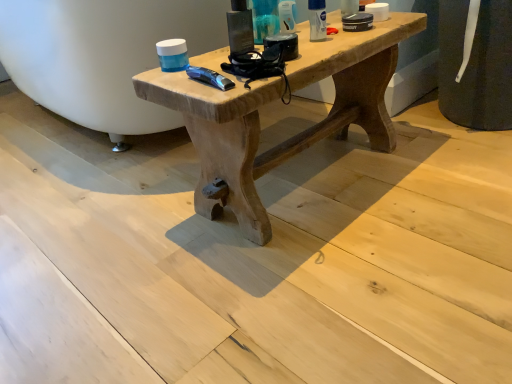
Question: Is point (320, 16) closer or farther from the camera than point (266, 4)?

Choices:
 (A) closer
 (B) farther

Answer: (B)

Question: In terms of size, does white matte deodorant at upper right, the first toiletry from the right, appear bigger or smaller than matte plastic container at upper center, placed as the 3th toiletry when sorted from right to left?

Choices:
 (A) big
 (B) small

Answer: (B)

Question: Considering the real-world distances, which object is farthest from the natural wood table at center?

Choices:
 (A) white matte deodorant at upper right, positioned as the third toiletry in left-to-right order
 (B) translucent plastic tube at upper center, the second toiletry viewed from the left
 (C) matte plastic container at upper center, the 1th toiletry viewed from the left

Answer: (B)

Question: Which object is the closest to the matte plastic container at upper center, the 1th toiletry viewed from the left?

Choices:
 (A) natural wood table at center
 (B) translucent plastic tube at upper center, the second toiletry viewed from the left
 (C) white matte deodorant at upper right, the first toiletry from the right

Answer: (B)